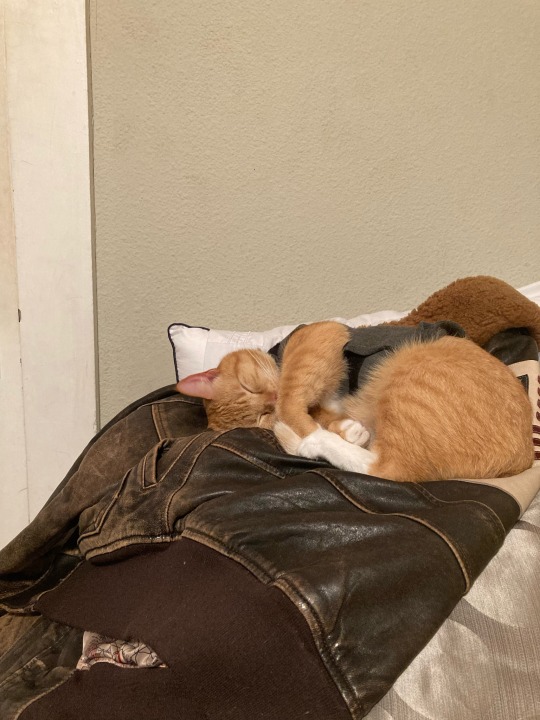
The width and height of the screenshot is (540, 720). What are the coordinates of `leather` in the screenshot? It's located at (310, 566).